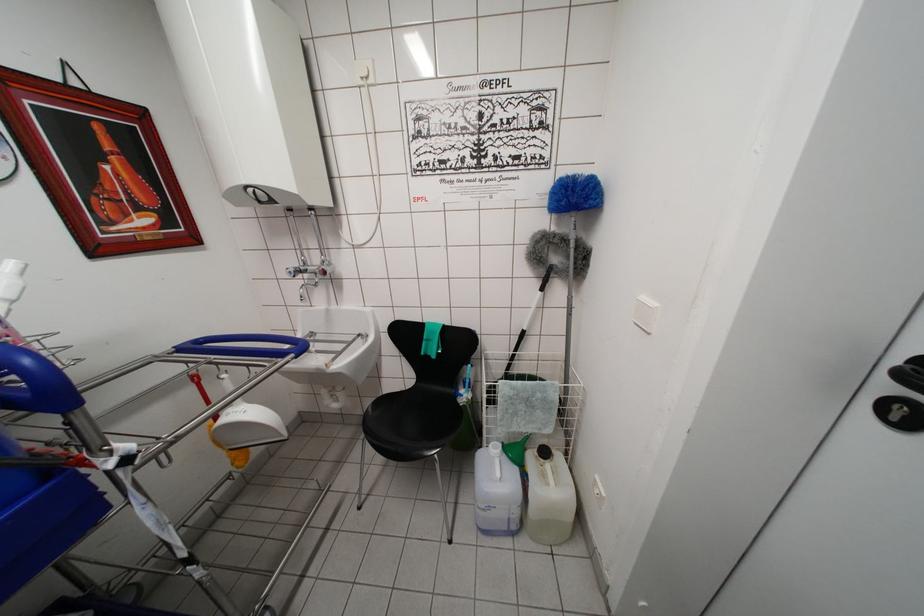
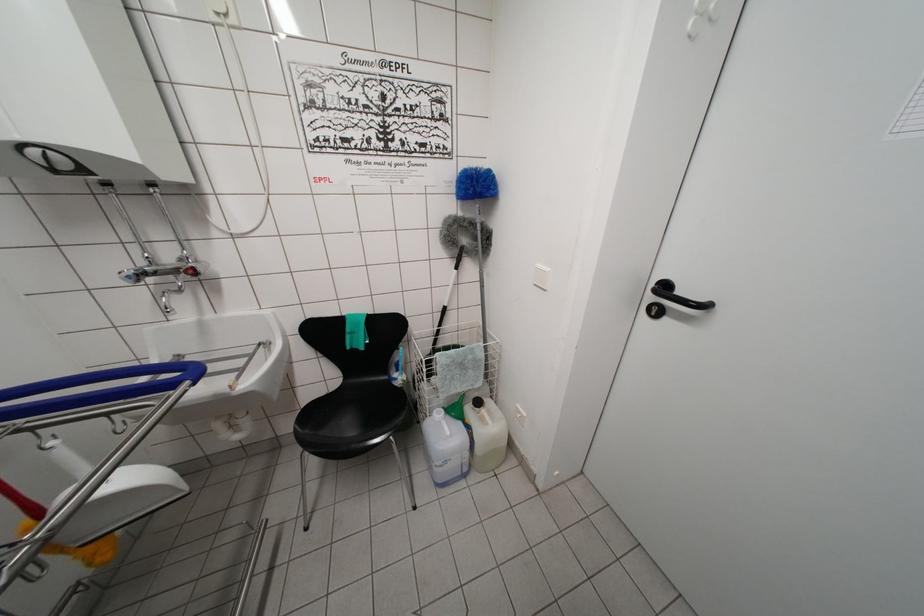
Question: What movement of the cameraman would produce the second image?

Choices:
 (A) Left
 (B) Right
 (C) Forward
 (D) Backward

Answer: (A)